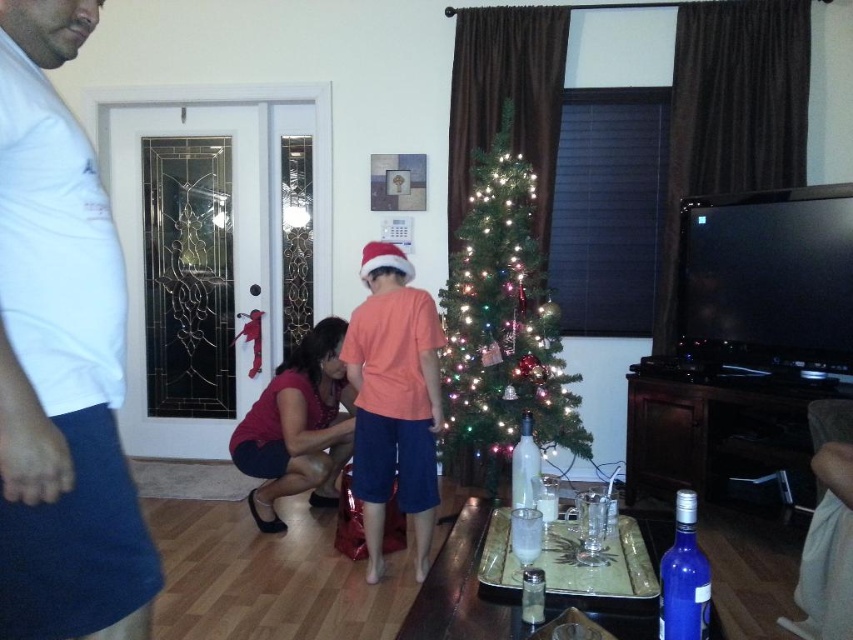
Question: Observing the image, what is the correct spatial positioning of green matte christmas tree at center in reference to orange matte shirt at center?

Choices:
 (A) above
 (B) below

Answer: (A)

Question: Does orange matte shirt at center appear on the left side of blue glass bottle at lower right?

Choices:
 (A) yes
 (B) no

Answer: (A)

Question: Can you confirm if white t-shirt at left is positioned below orange matte shirt at center?

Choices:
 (A) no
 (B) yes

Answer: (A)

Question: Which point appears farthest from the camera in this image?

Choices:
 (A) (115, 268)
 (B) (380, 561)

Answer: (B)

Question: Which point appears closest to the camera in this image?

Choices:
 (A) (471, 179)
 (B) (376, 508)

Answer: (B)

Question: Based on their relative distances, which object is nearer to the blue glass bottle at lower right?

Choices:
 (A) orange matte shirt at center
 (B) green matte christmas tree at center
 (C) white t-shirt at left

Answer: (C)